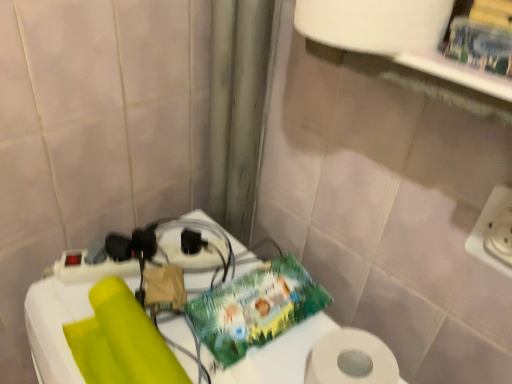
Question: From a real-world perspective, relative to white plastic table at lower left, is white plastic electric outlet at right vertically above or below?

Choices:
 (A) above
 (B) below

Answer: (A)

Question: Considering the positions of white plastic electric outlet at right and white plastic table at lower left in the image, is white plastic electric outlet at right wider or thinner than white plastic table at lower left?

Choices:
 (A) wide
 (B) thin

Answer: (B)

Question: Which is nearer to the white plastic table at lower left?

Choices:
 (A) black plastic socket at center
 (B) white plastic electric outlet at right

Answer: (A)

Question: Estimate the real-world distances between objects in this image. Which object is farther from the white plastic electric outlet at right?

Choices:
 (A) black plastic socket at center
 (B) white plastic table at lower left

Answer: (A)